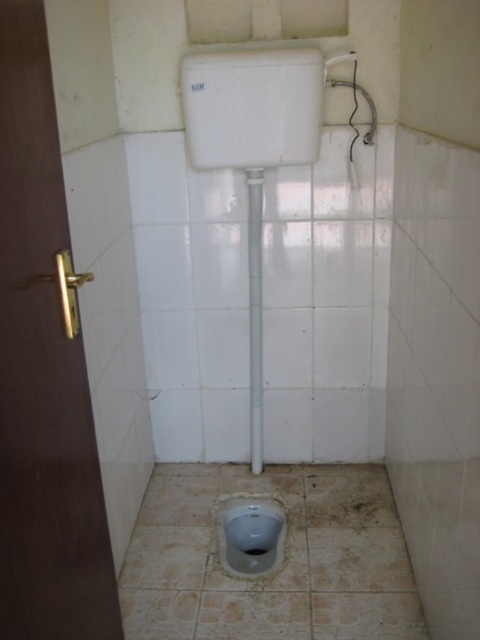
Is matte gray toilet bowl at lower center above gray matte urinal at center?

Indeed, matte gray toilet bowl at lower center is positioned over gray matte urinal at center.

Which is in front, point (263, 572) or point (260, 547)?

Positioned in front is point (263, 572).

This screenshot has width=480, height=640. I want to click on matte gray toilet bowl at lower center, so click(x=250, y=532).